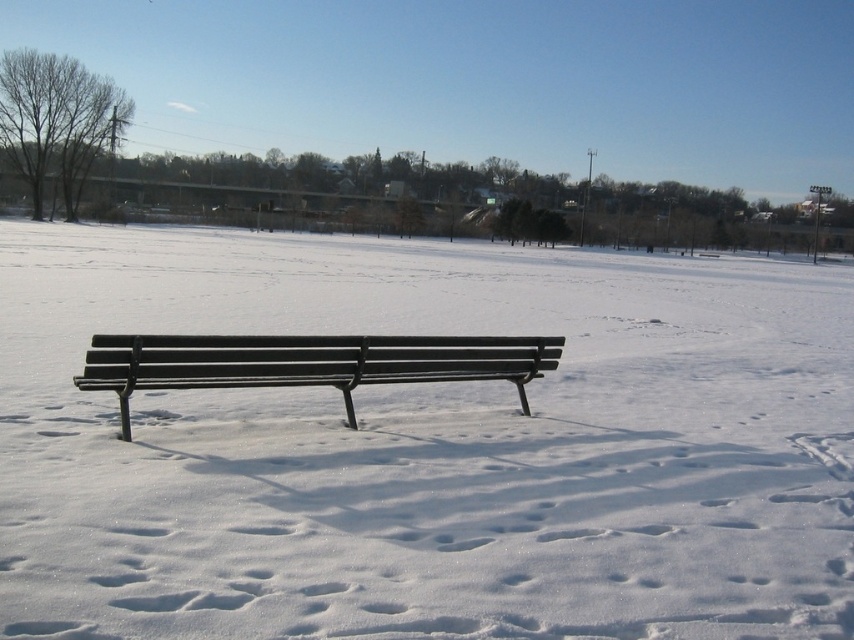
Question: Is white matte bench at center above matte black bench at center?

Choices:
 (A) no
 (B) yes

Answer: (B)

Question: Does white matte bench at center appear on the left side of matte black bench at center?

Choices:
 (A) no
 (B) yes

Answer: (A)

Question: Which of the following is the closest to the observer?

Choices:
 (A) matte black bench at center
 (B) white matte bench at center

Answer: (B)

Question: Is white matte bench at center positioned in front of matte black bench at center?

Choices:
 (A) yes
 (B) no

Answer: (A)

Question: Which of the following is the farthest from the observer?

Choices:
 (A) (604, 285)
 (B) (129, 381)

Answer: (A)